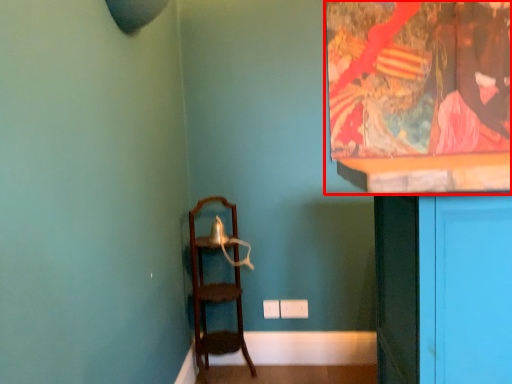
Question: From the image, what is the correct spatial relationship of picture frame (annotated by the red box) in relation to furniture?

Choices:
 (A) left
 (B) right

Answer: (B)